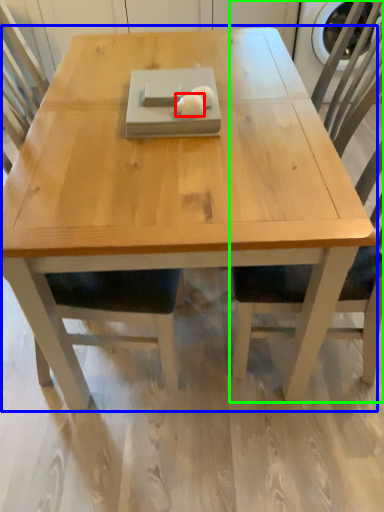
Question: Which object is positioned closest to food (highlighted by a red box)? Select from coffee table (highlighted by a blue box) and chair (highlighted by a green box).

Choices:
 (A) coffee table
 (B) chair

Answer: (A)